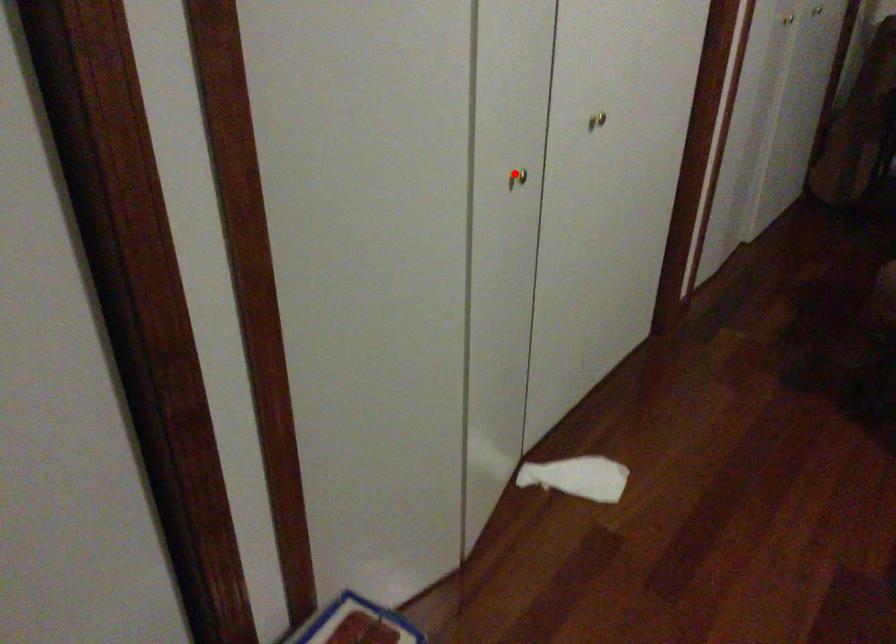
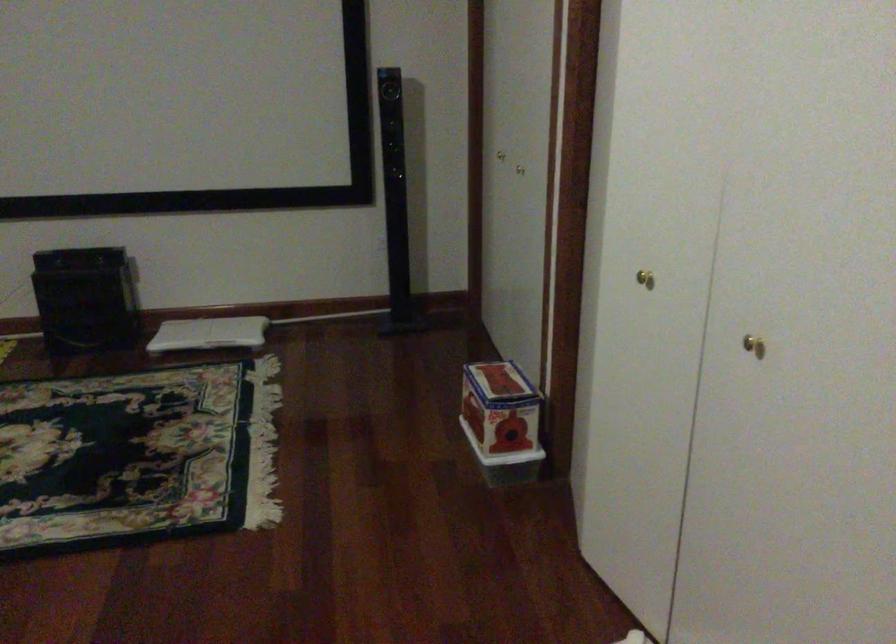
Question: I am providing you with two images of the same scene from different viewpoints. A red point is shown in image1. For the corresponding object point in image2, is it positioned nearer or farther from the camera?

Choices:
 (A) Nearer
 (B) Farther

Answer: (B)